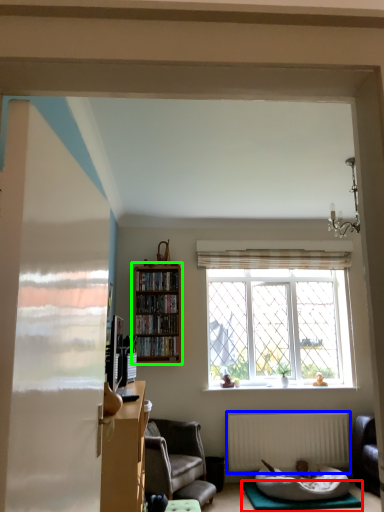
Question: Which object is positioned closest to yoga mat (highlighted by a red box)? Select from radiator (highlighted by a blue box) and bookcase (highlighted by a green box).

Choices:
 (A) radiator
 (B) bookcase

Answer: (A)